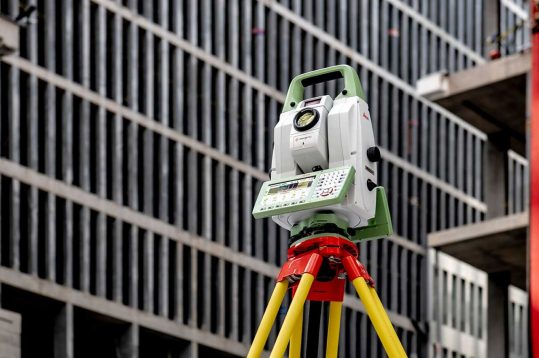
You are a GUI agent. You are given a task and a screenshot of the screen. Output one action in this format:
    pyautogui.click(x=<x>, y=<y>)
    Task: Click on the handle
    The height and width of the screenshot is (358, 539).
    Given the screenshot: What is the action you would take?
    pyautogui.click(x=330, y=70)